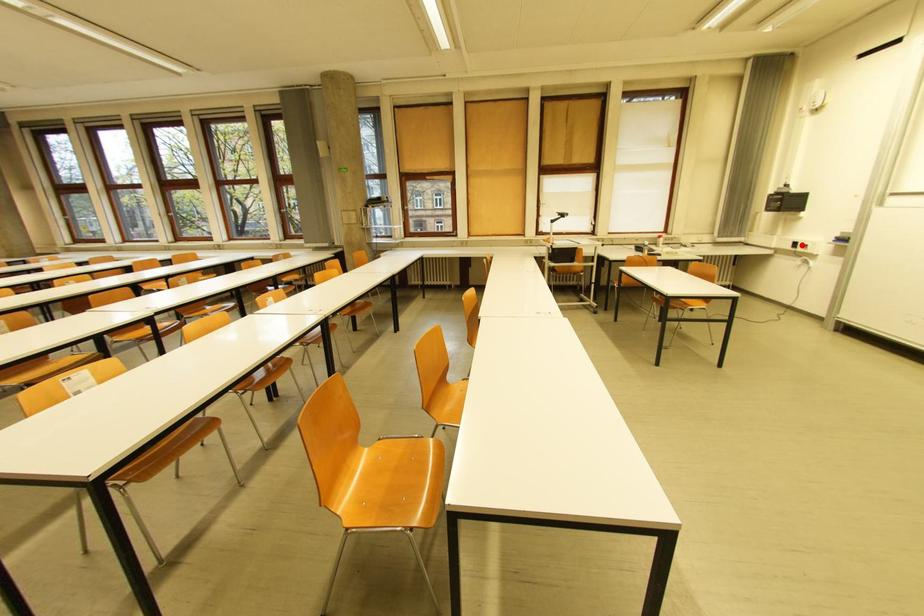
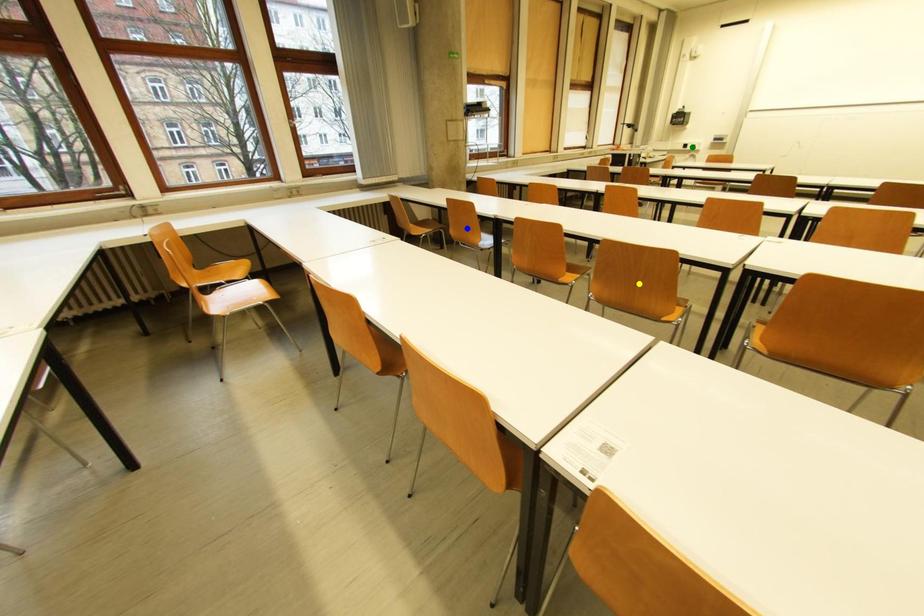
Question: I am providing you with two images of the same scene from different viewpoints. A red point is marked on the first image. You are given multiple points on the second image. Which point in image 2 represents the same 3d spot as the red point in image 1?

Choices:
 (A) green point
 (B) blue point
 (C) yellow point

Answer: (A)